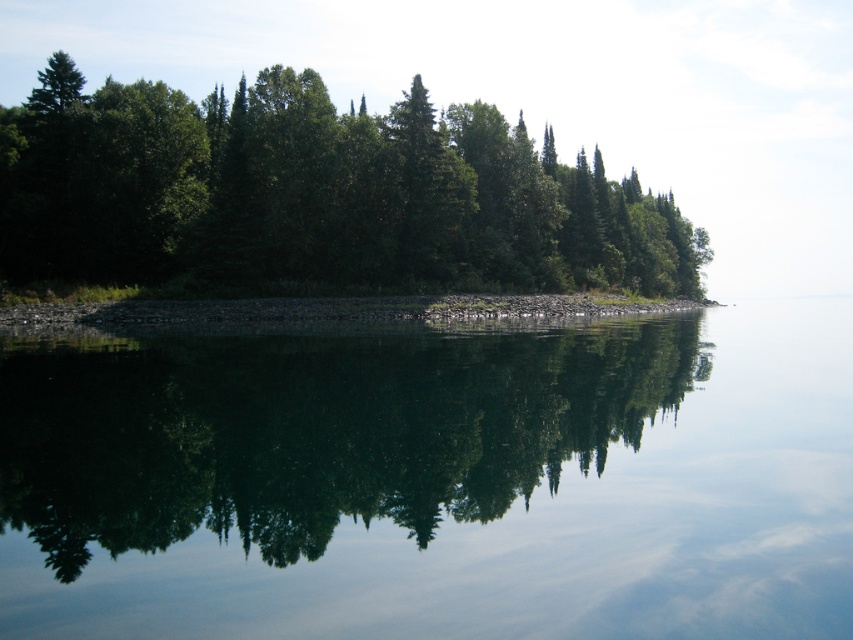
You are a kayaker planning to navigate through the transparent water at center and the green leafy trees at center. Which path has a narrower width for your kayak?

The transparent water at center has a narrower width than the green leafy trees at center, so the transparent water at center path is narrower for your kayak.

You are standing on the rocky shoreline and want to reach the calm water at the center of the scene. Which object do you need to step over or around first, the transparent water at center or the gray gravel shoreline at center?

You need to step over the gray gravel shoreline at center first because the transparent water at center is closer to the viewer, meaning the gray gravel shoreline is behind it and thus further away from your current position on the shoreline.

You are standing at the shoreline looking at the serene landscape. There are two points marked in the image, point (479, 250) and point (126, 304). Which point is closer to your viewpoint?

Point (126, 304) is closer to your viewpoint because it is less further than point (479, 250).